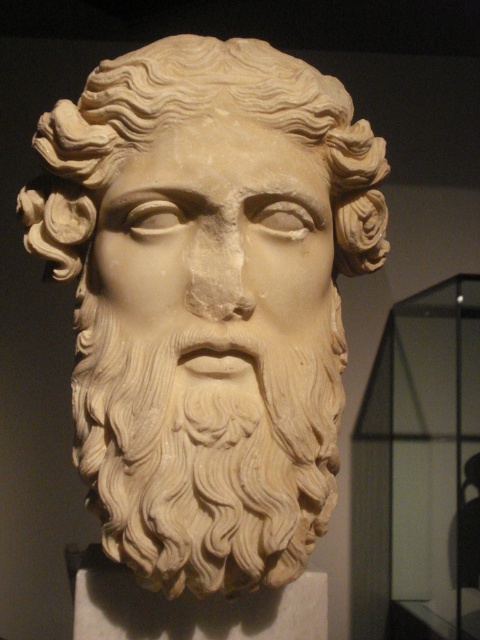
Question: Based on their relative distances, which object is nearer to the white marble face at center?

Choices:
 (A) white marble head at center
 (B) white stone beard at center

Answer: (A)

Question: Does white marble head at center have a lesser width compared to white stone beard at center?

Choices:
 (A) no
 (B) yes

Answer: (A)

Question: Which point is closer to the camera?

Choices:
 (A) (103, 317)
 (B) (276, 339)
 (C) (204, 452)

Answer: (C)

Question: Does white marble head at center lie in front of white stone beard at center?

Choices:
 (A) no
 (B) yes

Answer: (A)

Question: Which of the following is the farthest from the observer?

Choices:
 (A) white marble face at center
 (B) white marble head at center

Answer: (A)

Question: Where is white stone beard at center located in relation to white marble face at center in the image?

Choices:
 (A) right
 (B) left

Answer: (A)